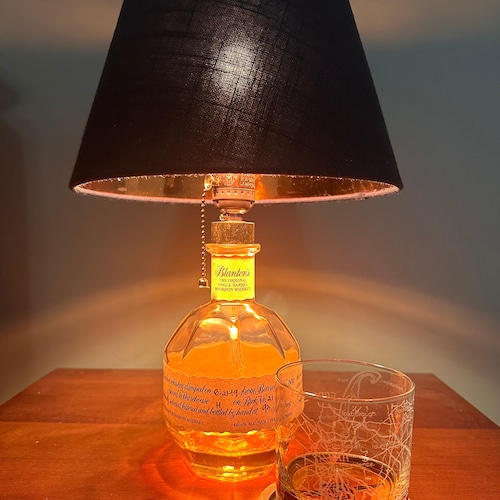
This screenshot has height=500, width=500. I want to click on bottle, so pyautogui.click(x=224, y=340).